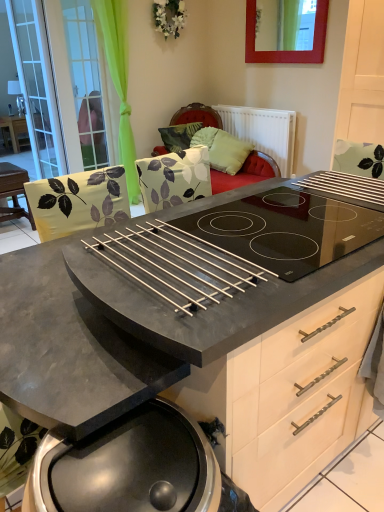
Question: From a real-world perspective, is green fabric screen door at upper left, the second screen door in the left-to-right sequence, above or below matte black table at left, the first table when ordered from left to right?

Choices:
 (A) below
 (B) above

Answer: (B)

Question: Which is correct: green fabric screen door at upper left, the second screen door in the left-to-right sequence, is inside matte black table at left, the first table from the back, or outside of it?

Choices:
 (A) inside
 (B) outside

Answer: (B)

Question: Estimate the real-world distances between objects in this image. Which object is closer to the green fabric screen door at upper left, which is counted as the 1th screen door, starting from the right?

Choices:
 (A) red wood picture frame at upper center
 (B) metallic matte barbecue grill at lower center
 (C) transparent glass screen door at left, which is the second screen door in right-to-left order
 (D) white matte radiator at upper center
 (E) matte black table at left, acting as the second table starting from the front

Answer: (C)

Question: Which object is positioned farthest from the green leaf-patterned pillow at upper center, which is counted as the 1th pillow, starting from the left?

Choices:
 (A) green fabric screen door at upper left, the second screen door in the left-to-right sequence
 (B) matte black table at left, the second table in the top-to-bottom sequence
 (C) green fabric pillow at center, the 2th pillow viewed from the left
 (D) white matte radiator at upper center
 (E) red wood picture frame at upper center

Answer: (B)